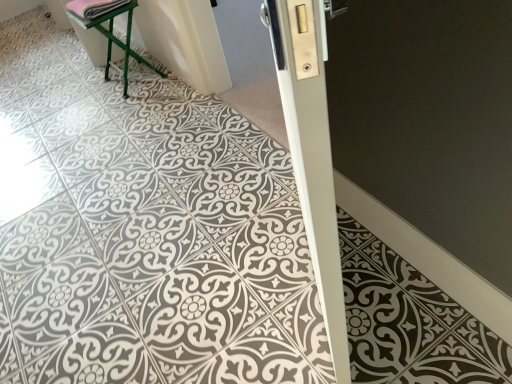
Question: In terms of height, does green metal stool at upper left look taller or shorter compared to pink fabric at upper left?

Choices:
 (A) tall
 (B) short

Answer: (A)

Question: Is point (118, 6) closer or farther from the camera than point (103, 9)?

Choices:
 (A) closer
 (B) farther

Answer: (B)

Question: Considering the real-world distances, which object is farthest from the pink fabric at upper left?

Choices:
 (A) green metal stool at upper left
 (B) white glossy door at center

Answer: (B)

Question: Estimate the real-world distances between objects in this image. Which object is closer to the pink fabric at upper left?

Choices:
 (A) green metal stool at upper left
 (B) white glossy door at center

Answer: (A)